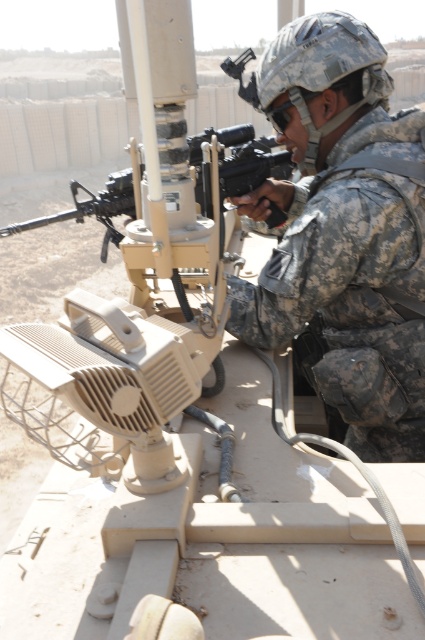
In the scene shown: Is camouflage fabric helmet at upper right smaller than matte black rifle at center?

No, camouflage fabric helmet at upper right is not smaller than matte black rifle at center.

Is point (314, 49) less distant than point (130, 204)?

Yes, point (314, 49) is in front of point (130, 204).

Is point (370, 106) farther from viewer compared to point (11, 230)?

No, (370, 106) is in front of (11, 230).

Where is `camouflage fabric helmet at upper right`? camouflage fabric helmet at upper right is located at coordinates (343, 228).